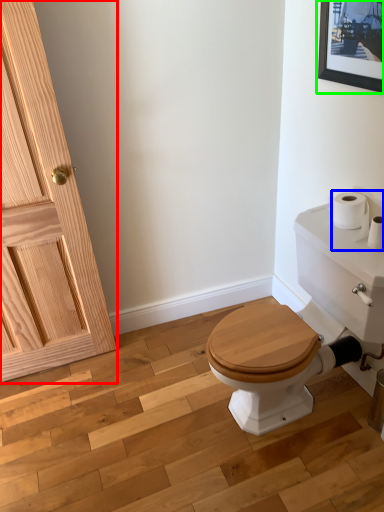
Question: Based on their relative distances, which object is nearer to door (highlighted by a red box)? Choose from toilet paper (highlighted by a blue box) and picture frame (highlighted by a green box).

Choices:
 (A) toilet paper
 (B) picture frame

Answer: (B)